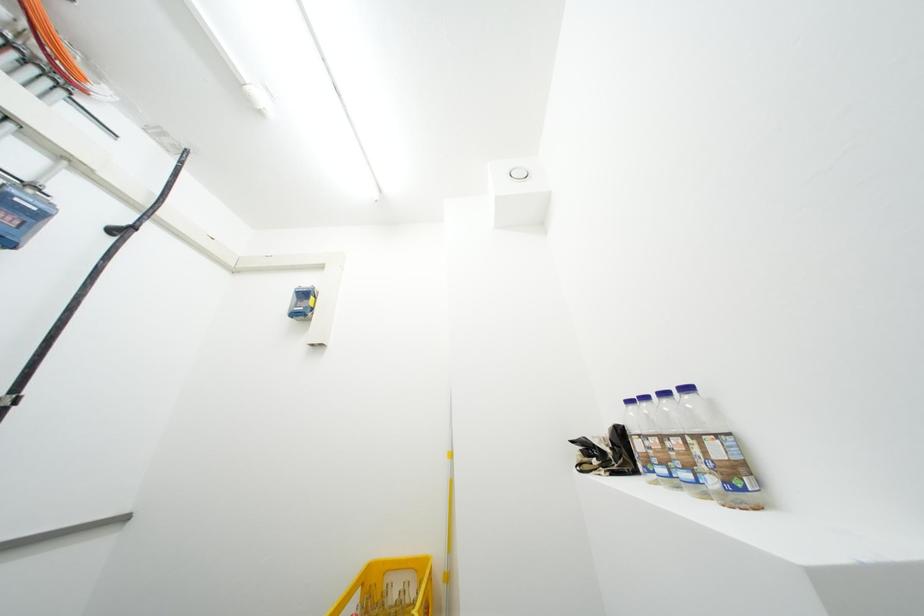
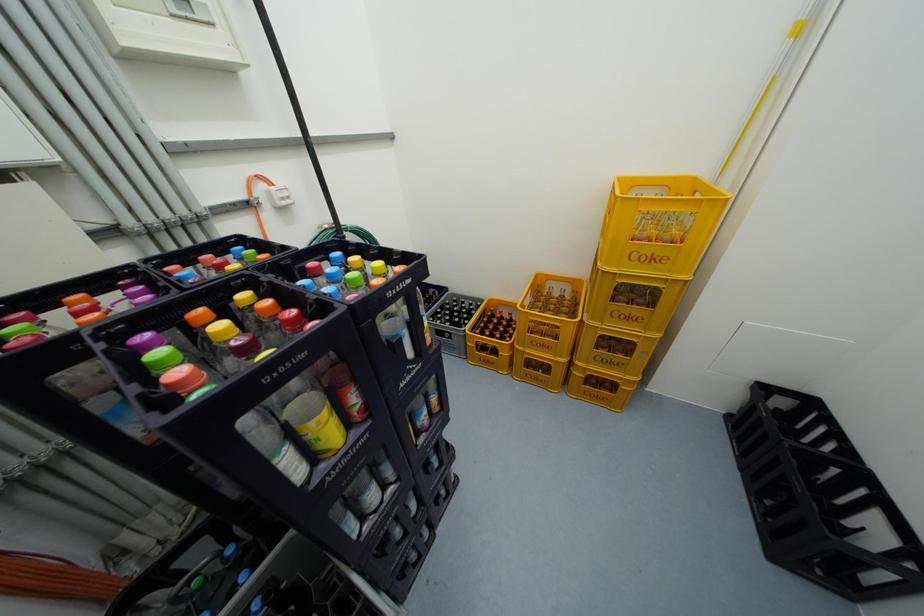
How did the camera likely rotate?

The rotation direction of the camera is left-down.